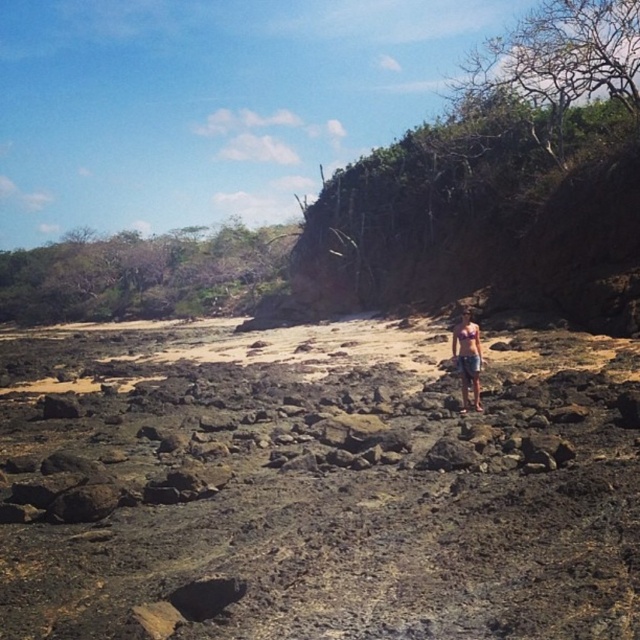
Question: Does dark brown lava rocks at center lie in front of matte pink bikini top at center?

Choices:
 (A) yes
 (B) no

Answer: (A)

Question: Is dark brown lava rocks at center wider than matte pink bikini top at center?

Choices:
 (A) no
 (B) yes

Answer: (B)

Question: Which point appears farthest from the camera in this image?

Choices:
 (A) (472, 385)
 (B) (484, 596)

Answer: (A)

Question: Which point appears farthest from the camera in this image?

Choices:
 (A) (150, 416)
 (B) (465, 323)

Answer: (A)

Question: Does dark brown lava rocks at center appear over matte pink bikini top at center?

Choices:
 (A) no
 (B) yes

Answer: (A)